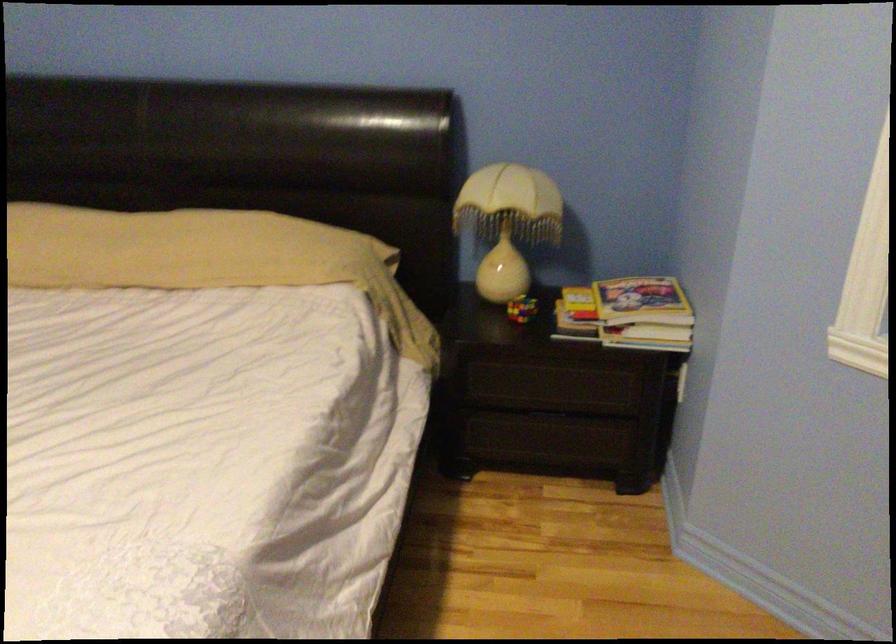
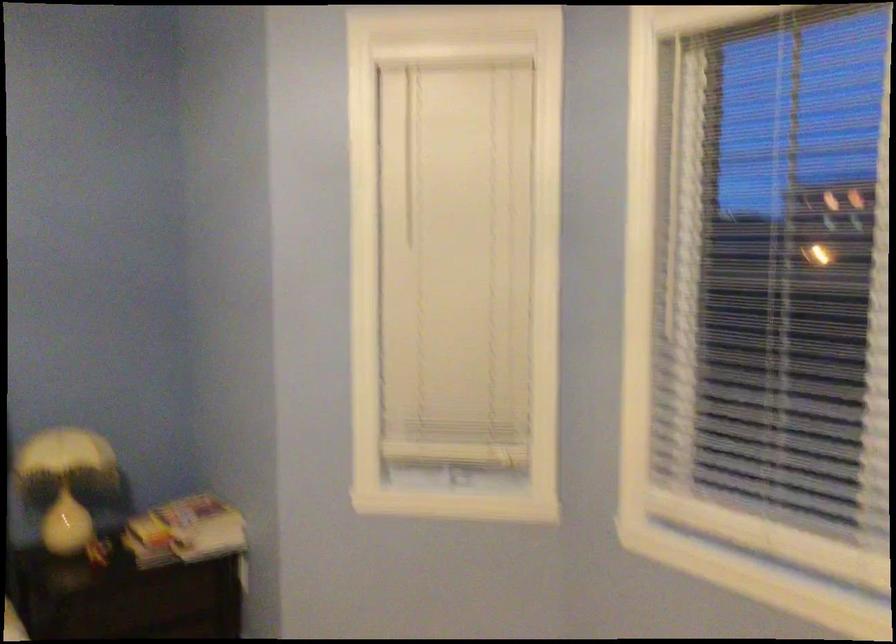
Question: How did the camera likely rotate?

Choices:
 (A) Left
 (B) Right
 (C) Up
 (D) Down

Answer: (B)